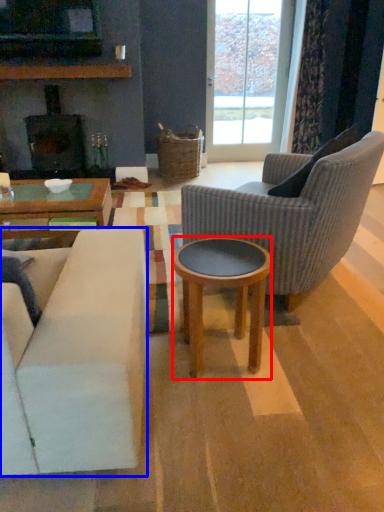
Question: Which point is further to the camera, coffee table (highlighted by a red box) or studio couch (highlighted by a blue box)?

Choices:
 (A) coffee table
 (B) studio couch

Answer: (A)